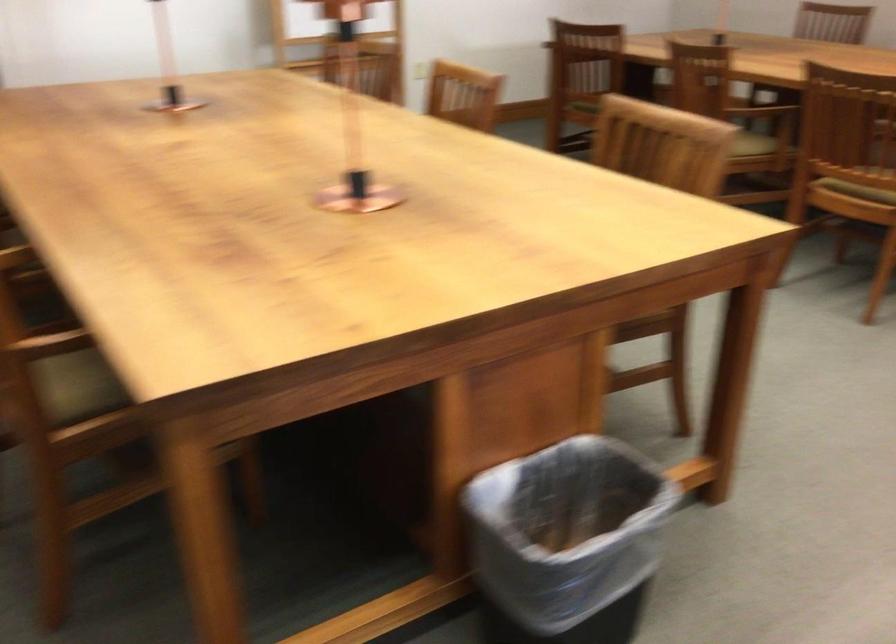
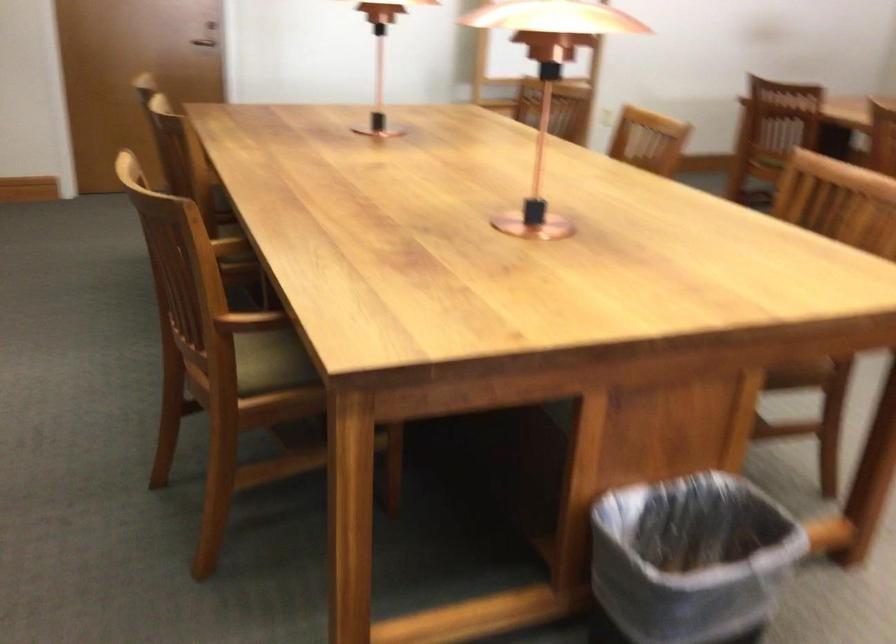
In the second image, find the point that corresponds to point (645, 321) in the first image.

(799, 374)